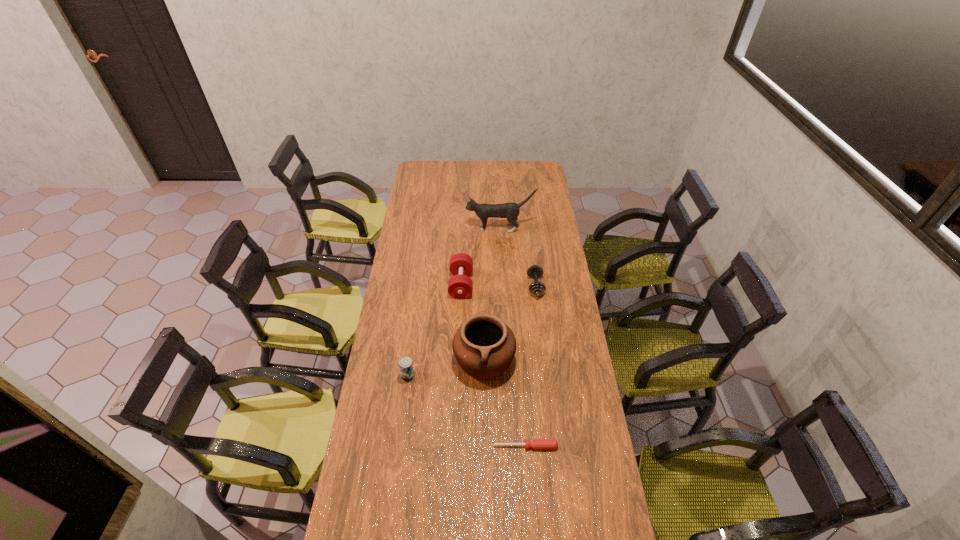
Identify the location of free space between the farthest object and the fifth tallest object. (517, 257).

Locate which object ranks third in proximity to the farthest object. Please provide its 2D coordinates. Your answer should be formatted as a tuple, i.e. [(x, y)], where the tuple contains the x and y coordinates of a point satisfying the conditions above.

[(484, 346)]

Choose which object is the fourth nearest neighbor to the left dumbbell. Please provide its 2D coordinates. Your answer should be formatted as a tuple, i.e. [(x, y)], where the tuple contains the x and y coordinates of a point satisfying the conditions above.

[(405, 363)]

At what (x,y) coordinates should I click in order to perform the action: click on free space in the image that satisfies the following two spatial constraints: 1. on the back side of the fifth tallest object; 2. on the right side of the screwdriver. Please return your answer as a coordinate pair (x, y). Image resolution: width=960 pixels, height=540 pixels. Looking at the image, I should click on (514, 286).

This screenshot has height=540, width=960. Identify the location of free space that satisfies the following two spatial constraints: 1. at the face of the farthest object; 2. on the front side of the left dumbbell. (503, 284).

The width and height of the screenshot is (960, 540). In order to click on vacant position in the image that satisfies the following two spatial constraints: 1. on the front side of the second shortest object; 2. on the left side of the left dumbbell in this screenshot , I will do `click(461, 286)`.

Find the location of a particular element. This screenshot has height=540, width=960. vacant position in the image that satisfies the following two spatial constraints: 1. at the face of the tallest object; 2. on the back side of the shorter dumbbell is located at coordinates (503, 286).

This screenshot has width=960, height=540. What are the coordinates of `free spot that satisfies the following two spatial constraints: 1. at the face of the cat; 2. on the front side of the taller dumbbell` in the screenshot? It's located at click(x=503, y=284).